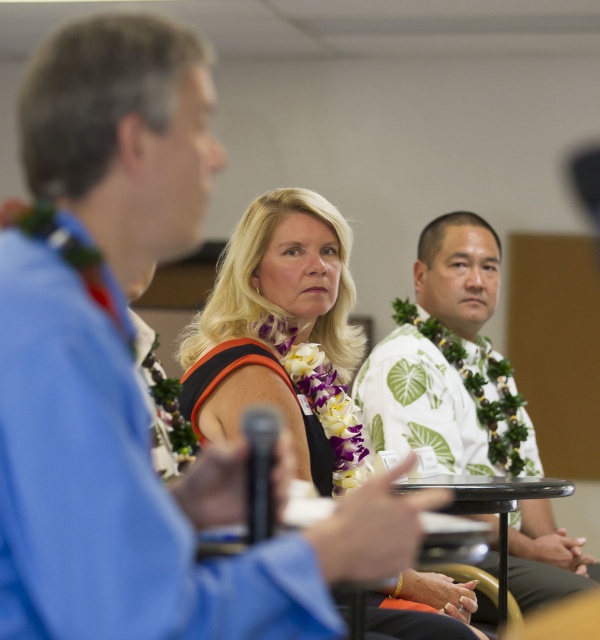
Question: Which point is farther to the camera?

Choices:
 (A) black plastic table at center
 (B) black satin dress at center
 (C) black plastic microphone at center
 (D) white leaf-patterned shirt at center

Answer: (D)

Question: Is black satin dress at center above black plastic table at center?

Choices:
 (A) yes
 (B) no

Answer: (A)

Question: Can you confirm if black satin dress at center is positioned below black plastic table at center?

Choices:
 (A) no
 (B) yes

Answer: (A)

Question: Does white leaf-patterned shirt at center come behind black plastic microphone at center?

Choices:
 (A) yes
 (B) no

Answer: (A)

Question: Which object appears farthest from the camera in this image?

Choices:
 (A) black plastic microphone at center
 (B) white leaf-patterned shirt at center
 (C) black satin dress at center
 (D) black plastic table at center

Answer: (B)

Question: Which of the following is the closest to the observer?

Choices:
 (A) (298, 408)
 (B) (253, 465)
 (C) (478, 509)
 (D) (459, 449)

Answer: (B)